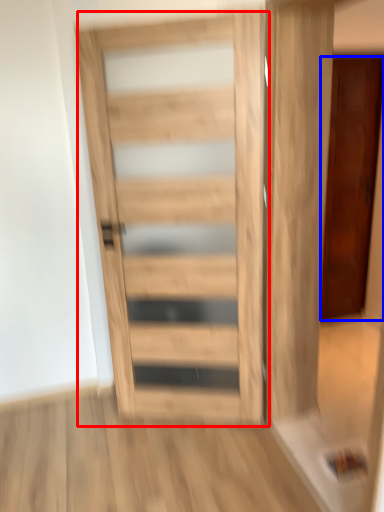
Question: Among these objects, which one is farthest to the camera, door (highlighted by a red box) or door (highlighted by a blue box)?

Choices:
 (A) door
 (B) door

Answer: (B)